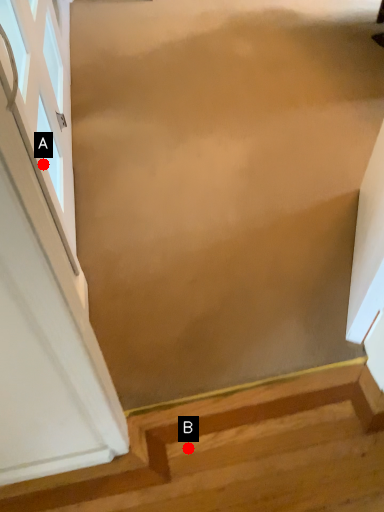
Question: Two points are circled on the image, labeled by A and B beside each circle. Which of the following is the closest to the observer?

Choices:
 (A) A is closer
 (B) B is closer

Answer: (B)